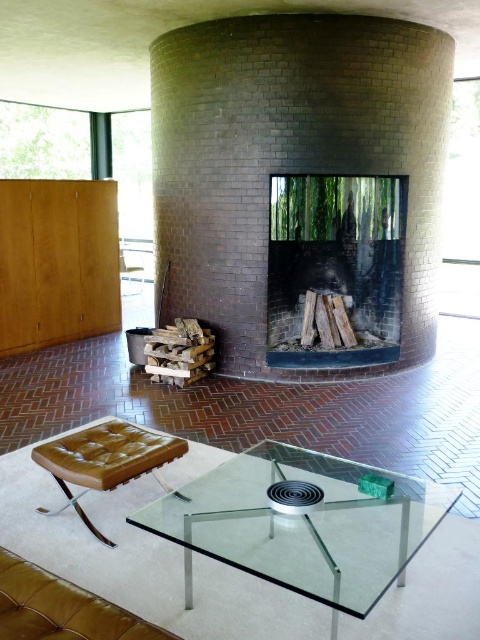
Question: Can you confirm if brick fireplace at center is thinner than brown leather ottoman at center?

Choices:
 (A) yes
 (B) no

Answer: (B)

Question: Does brown leather couch at lower left have a greater width compared to brown leather ottoman at center?

Choices:
 (A) yes
 (B) no

Answer: (B)

Question: Which of the following is the closest to the observer?

Choices:
 (A) transparent glass table at center
 (B) brown leather armchair at center

Answer: (A)

Question: Which is nearer to the brown leather ottoman at center?

Choices:
 (A) brick fireplace at center
 (B) brown leather couch at lower left
 (C) black brick fireplace at center
 (D) transparent glass table at center

Answer: (D)

Question: Does brown leather ottoman at center have a greater width compared to brown leather armchair at center?

Choices:
 (A) yes
 (B) no

Answer: (A)

Question: Which point is farther from the camera taking this photo?

Choices:
 (A) (139, 257)
 (B) (408, 493)
 (C) (180, 454)

Answer: (A)